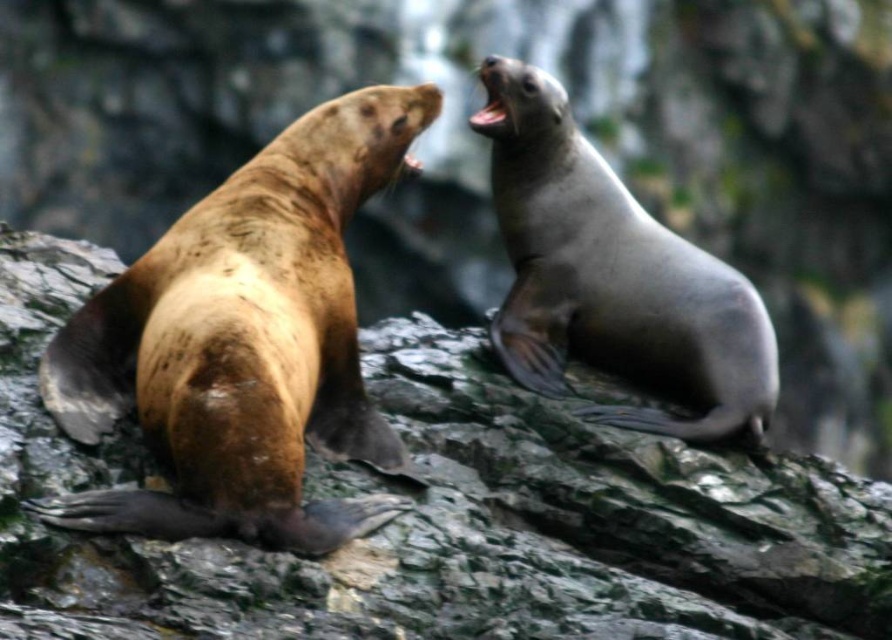
Question: Considering the real-world distances, which object is closest to the green rock at center?

Choices:
 (A) brown fur seal at left
 (B) smooth gray seal at upper right

Answer: (A)

Question: Is green rock at center wider than smooth gray seal at upper right?

Choices:
 (A) yes
 (B) no

Answer: (A)

Question: Which point is farther from the camera taking this photo?

Choices:
 (A) (568, 173)
 (B) (186, 508)

Answer: (A)

Question: Does green rock at center have a smaller size compared to smooth gray seal at upper right?

Choices:
 (A) yes
 (B) no

Answer: (B)

Question: Does green rock at center have a greater width compared to smooth gray seal at upper right?

Choices:
 (A) no
 (B) yes

Answer: (B)

Question: Which point is closer to the camera taking this photo?

Choices:
 (A) (618, 362)
 (B) (175, 252)

Answer: (B)